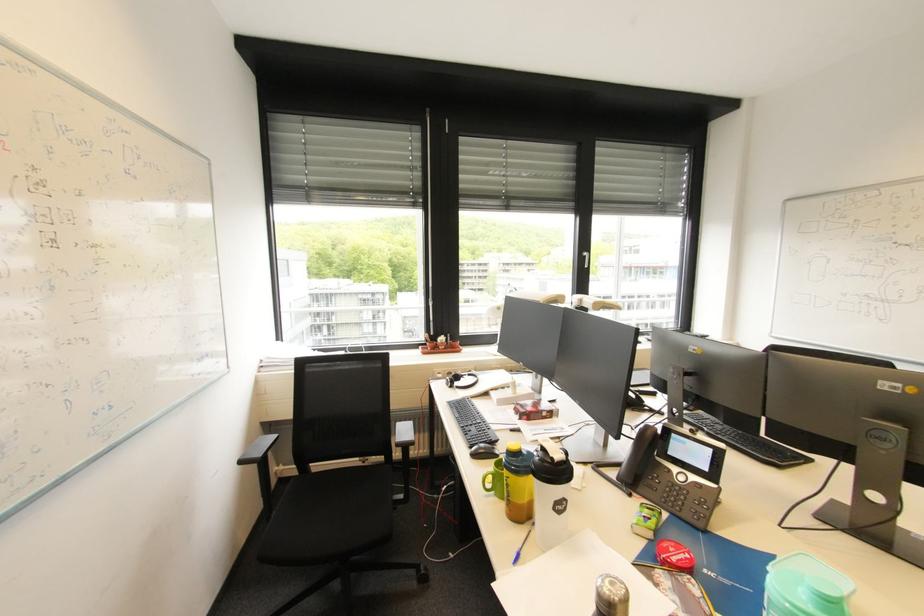
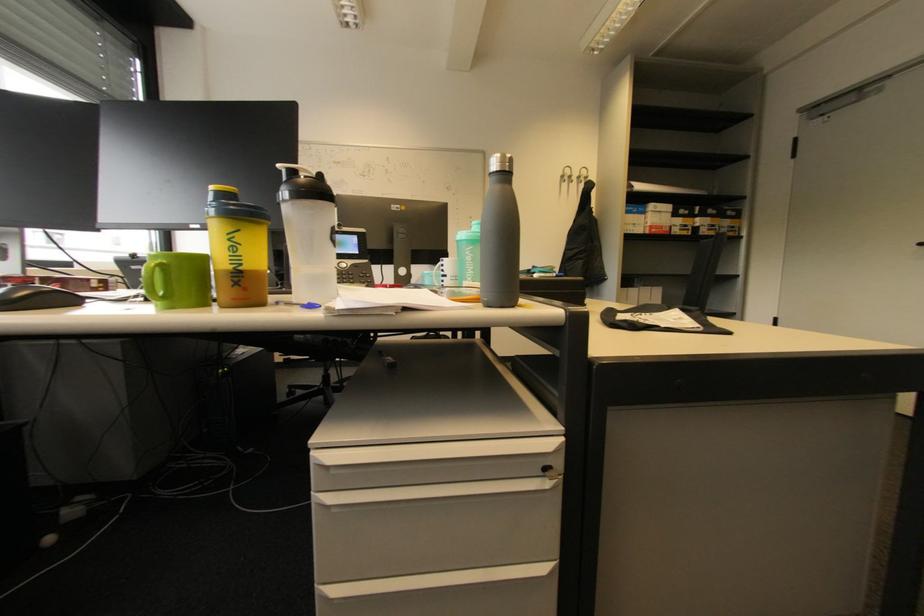
In the second image, find the point that corresponds to (513,507) in the first image.

(239, 286)